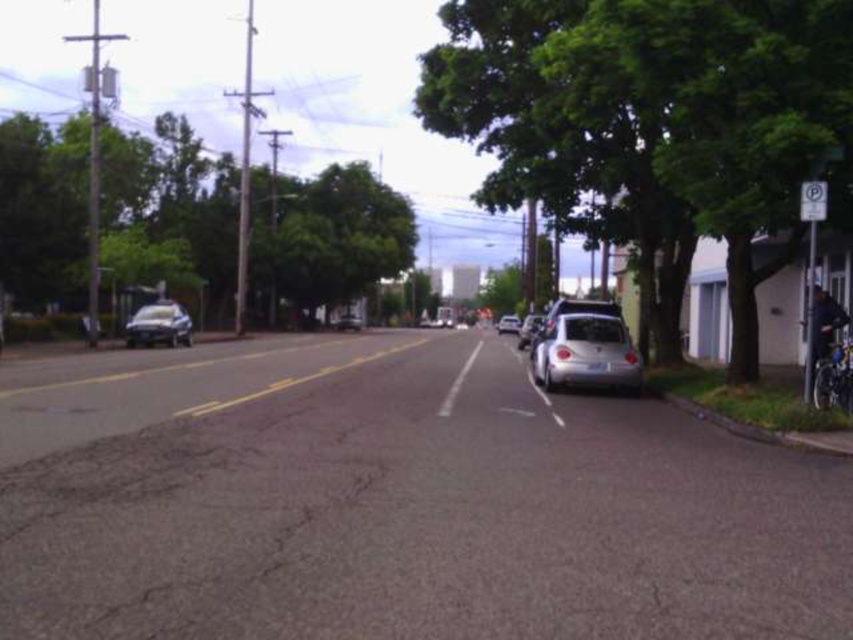
Question: Which is farther from the green leafy tree at right?

Choices:
 (A) silver metallic car at center
 (B) green leafy tree at left
 (C) silver metallic hatchback at right

Answer: (A)

Question: Can you confirm if green leafy tree at left is smaller than silver metallic hatchback at right?

Choices:
 (A) yes
 (B) no

Answer: (B)

Question: Is green leafy tree at right bigger than green leafy tree at left?

Choices:
 (A) yes
 (B) no

Answer: (B)

Question: Which point appears farthest from the camera in this image?

Choices:
 (A) (347, 296)
 (B) (164, 340)
 (C) (604, 339)
 (D) (758, 115)

Answer: (A)

Question: Which object is farther from the camera taking this photo?

Choices:
 (A) green leafy tree at right
 (B) satin silver sedan at left
 (C) silver metallic hatchback at right
 (D) satin silver car at right

Answer: (C)

Question: Can you confirm if silver metallic hatchback at right is positioned above silver metallic car at center?

Choices:
 (A) no
 (B) yes

Answer: (B)